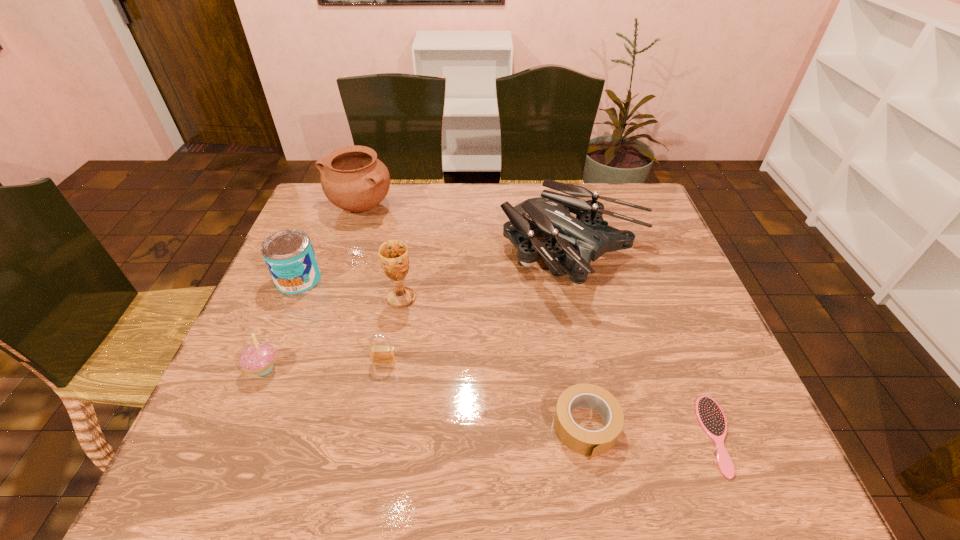
The height and width of the screenshot is (540, 960). What are the coordinates of `vacant area at the far right corner` in the screenshot? It's located at (612, 210).

Find the location of a particular element. This screenshot has height=540, width=960. vacant space at the near right corner of the desktop is located at coordinates (759, 478).

This screenshot has height=540, width=960. I want to click on empty space between the drone and the padlock, so click(x=479, y=308).

Identify the location of empty space that is in between the drone and the cupcake. The width and height of the screenshot is (960, 540). (419, 312).

The height and width of the screenshot is (540, 960). Find the location of `vacant area between the duct tape and the drone`. vacant area between the duct tape and the drone is located at coordinates (580, 341).

You are a GUI agent. You are given a task and a screenshot of the screen. Output one action in this format:
    pyautogui.click(x=<x>, y=<y>)
    Task: Click on the unoccupied area between the duct tape and the hairbrush
    
    Given the screenshot: What is the action you would take?
    pyautogui.click(x=652, y=431)

You are a GUI agent. You are given a task and a screenshot of the screen. Output one action in this format:
    pyautogui.click(x=<x>, y=<y>)
    Task: Click on the free space between the cupcake and the hairbrush
    This screenshot has width=960, height=540.
    Given the screenshot: What is the action you would take?
    pyautogui.click(x=491, y=402)

This screenshot has height=540, width=960. Identify the location of vacant region between the cupcake and the drone. [x=419, y=312].

Locate an element on the screen. vacant point located between the drone and the pottery is located at coordinates (467, 231).

Locate an element on the screen. vacant point located between the pottery and the duct tape is located at coordinates pos(472,316).